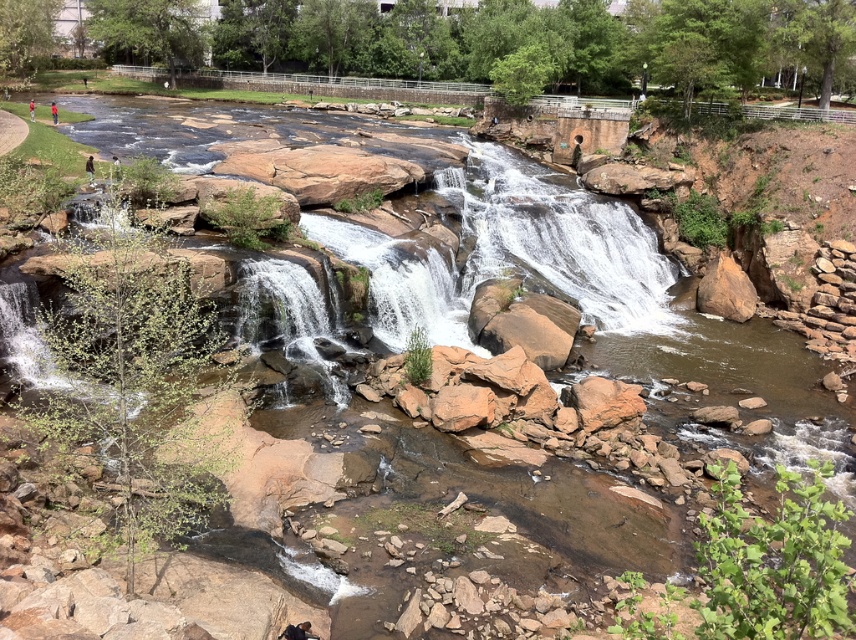
Question: Which point is closer to the camera?

Choices:
 (A) red shirt at lower left
 (B) green fabric person at upper left
 (C) brown leather jacket at upper left

Answer: (B)

Question: Does white smooth waterfall at center come behind red shirt at lower left?

Choices:
 (A) yes
 (B) no

Answer: (B)

Question: Estimate the real-world distances between objects in this image. Which object is closer to the white smooth waterfall at center?

Choices:
 (A) red shirt at lower left
 (B) red shirt at center
 (C) brown leather jacket at upper left
 (D) green fabric person at upper left

Answer: (D)

Question: Which object is the closest to the red shirt at center?

Choices:
 (A) red shirt at lower left
 (B) green fabric person at upper left

Answer: (A)

Question: Is white smooth waterfall at center closer to the viewer compared to brown leather jacket at upper left?

Choices:
 (A) no
 (B) yes

Answer: (A)

Question: Is green fabric person at upper left bigger than brown leather jacket at upper left?

Choices:
 (A) yes
 (B) no

Answer: (A)